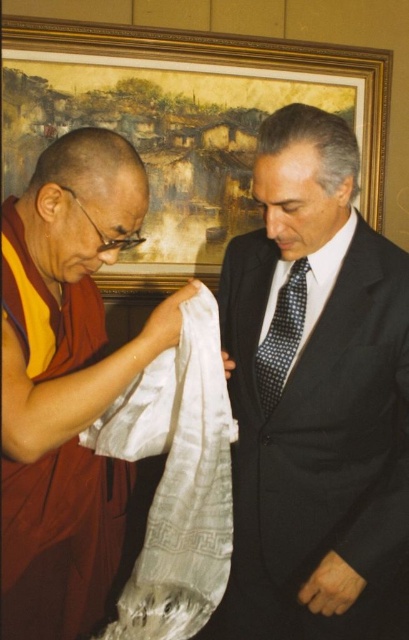
You are an event planner arranging a ceremony where both a monk and a professional attendee will be present. You need to ensure that the matte silk scarf at left and the white silk cloth at center are positioned correctly according to cultural protocols. Based on their spatial relationship in the image, which object should be placed closer to the attendees during the ceremony?

The matte silk scarf at left should be placed closer to the attendees because it is positioned in front of the white silk cloth at center in the image, indicating its prominence in the cultural context.

You are a photographer standing at the camera position. You want to take a photo of the scene. However, there is an obstacle at point (157, 344) that is 1.08 meters away from you. Can you determine if you can take the photo without moving the obstacle?

The obstacle at point (157, 344) is 1.08 meters away from the camera. Since the obstacle is at that distance, it may block the view unless it is removed or moved. Therefore, you cannot take the photo without moving the obstacle.